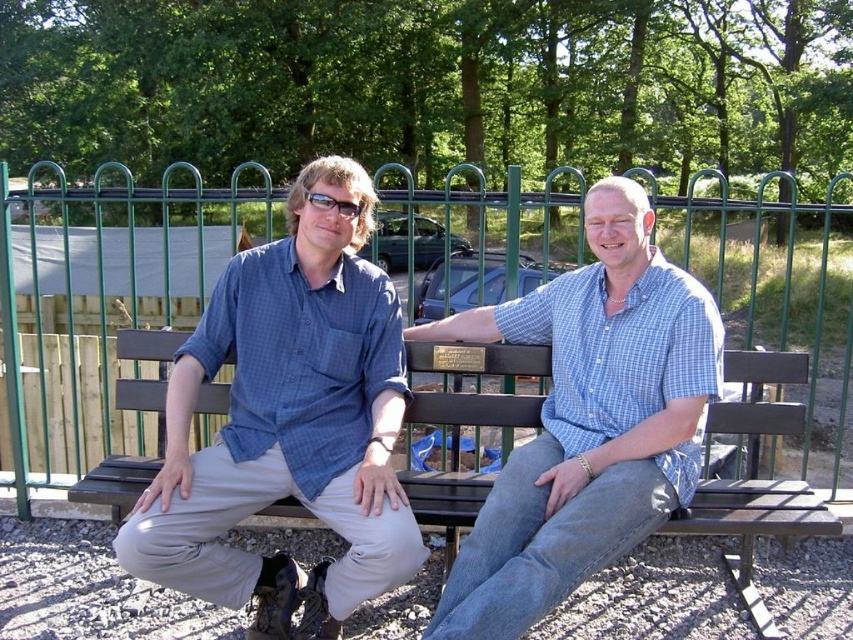
You are standing in front of the bench where the two people are sitting. You want to place a small gift exactly at the point marked by the coordinates point (587, 420). Which part of the blue checkered shirt at center should you aim for to place the gift there?

The point (587, 420) is located on the blue checkered shirt at center, so you should aim for that specific area of the blue checkered shirt at center to place the gift there.

You are standing in front of the bench where the two people are sitting. You want to take a photo of the green metal fence at upper center. To do this, you need to move in a straight line from your current position. In which direction should you move relative to the bench?

The green metal fence at upper center is located at point coordinates of 0.570 on the x axis and 0.089 on the y axis. Since the bench is positioned in front of the green metal fence at upper center, you should move backward away from the bench to face the fence directly.